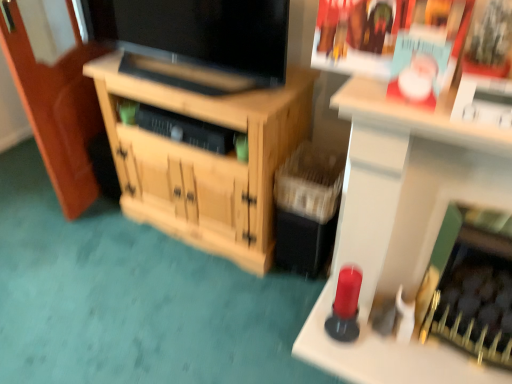
Question: Considering the relative sizes of matte paper magazine at upper right and matte black tv at center in the image provided, is matte paper magazine at upper right bigger than matte black tv at center?

Choices:
 (A) yes
 (B) no

Answer: (B)

Question: Is matte paper magazine at upper right to the right of matte black tv at center from the viewer's perspective?

Choices:
 (A) yes
 (B) no

Answer: (A)

Question: Is matte paper magazine at upper right with matte black tv at center?

Choices:
 (A) no
 (B) yes

Answer: (A)

Question: Is matte paper magazine at upper right positioned beyond the bounds of matte black tv at center?

Choices:
 (A) yes
 (B) no

Answer: (A)

Question: Is matte paper magazine at upper right shorter than matte black tv at center?

Choices:
 (A) no
 (B) yes

Answer: (B)

Question: Is matte paper magazine at upper right taller than matte black tv at center?

Choices:
 (A) no
 (B) yes

Answer: (A)

Question: Is wooden cabinet at center at the right side of matte paper magazine at upper right?

Choices:
 (A) no
 (B) yes

Answer: (A)

Question: Considering the relative sizes of wooden cabinet at center and matte paper magazine at upper right in the image provided, is wooden cabinet at center shorter than matte paper magazine at upper right?

Choices:
 (A) yes
 (B) no

Answer: (B)

Question: From the image's perspective, does wooden cabinet at center appear lower than matte paper magazine at upper right?

Choices:
 (A) no
 (B) yes

Answer: (B)

Question: Are wooden cabinet at center and matte paper magazine at upper right making contact?

Choices:
 (A) no
 (B) yes

Answer: (A)

Question: From the image's perspective, is wooden cabinet at center located above matte paper magazine at upper right?

Choices:
 (A) no
 (B) yes

Answer: (A)

Question: From a real-world perspective, is wooden cabinet at center on top of matte paper magazine at upper right?

Choices:
 (A) no
 (B) yes

Answer: (A)

Question: Considering the relative sizes of matte paper magazine at upper right and wooden cabinet at center in the image provided, is matte paper magazine at upper right wider than wooden cabinet at center?

Choices:
 (A) yes
 (B) no

Answer: (B)